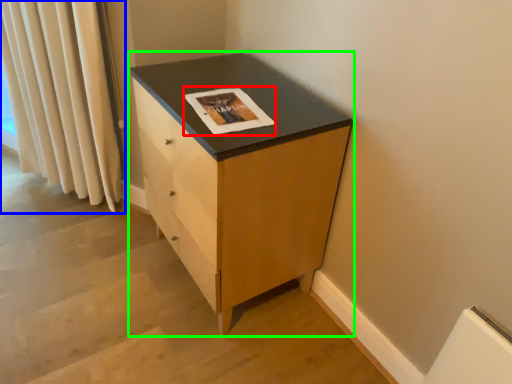
Question: Which is nearer to the magazine (highlighted by a red box)? curtain (highlighted by a blue box) or chest of drawers (highlighted by a green box).

Choices:
 (A) curtain
 (B) chest of drawers

Answer: (B)